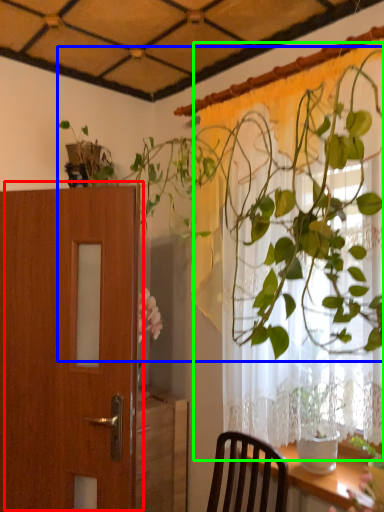
Question: Which object is positioned farthest from door (highlighted by a red box)? Select from houseplant (highlighted by a blue box) and curtain (highlighted by a green box).

Choices:
 (A) houseplant
 (B) curtain

Answer: (B)